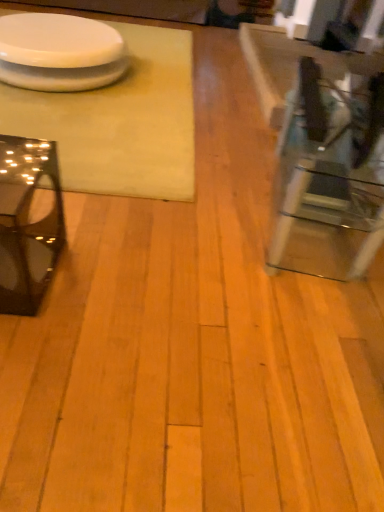
Find the location of a particular element. Image resolution: width=384 pixels, height=512 pixels. vacant space in front of clear glass table at right, the first table in the right-to-left sequence is located at coordinates (268, 318).